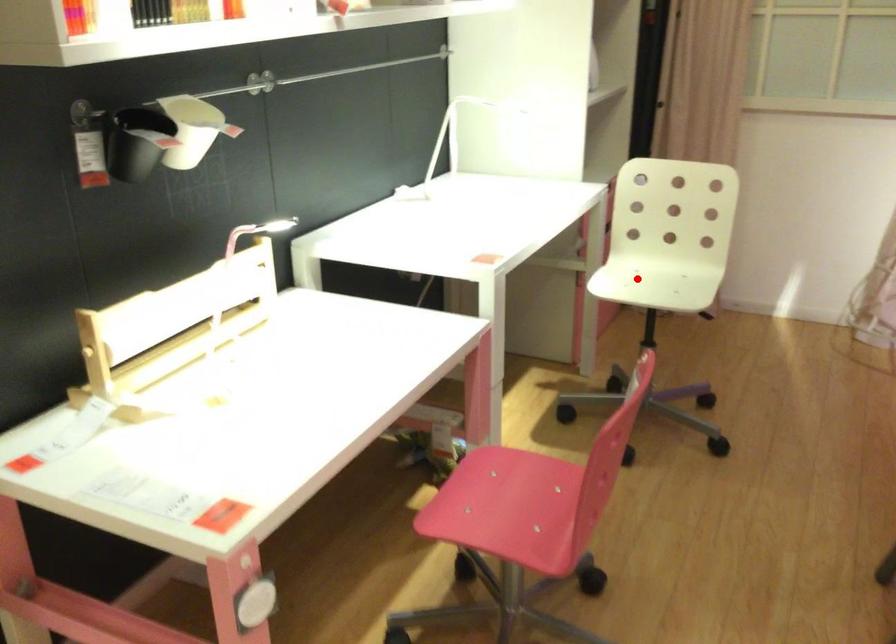
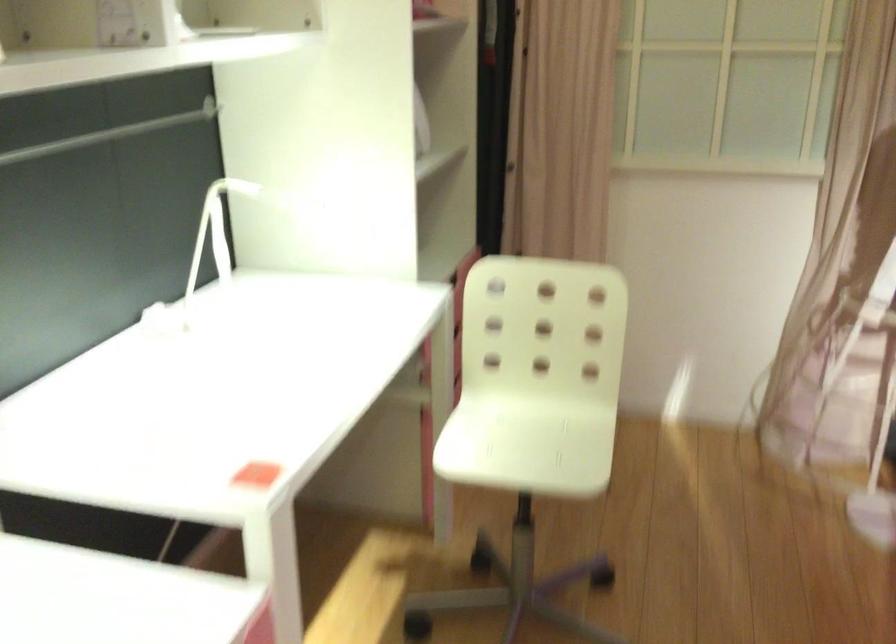
Question: I am providing you with two images of the same scene from different viewpoints. Given a red point in image1, look at the same physical point in image2. Is it:

Choices:
 (A) Closer to the viewpoint
 (B) Farther from the viewpoint

Answer: (A)